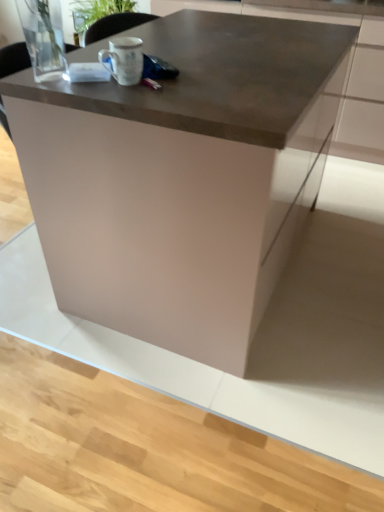
Where is `satin metallic countertop at upper center`? Image resolution: width=384 pixels, height=512 pixels. satin metallic countertop at upper center is located at coordinates (342, 81).

Is matte brown table at center oriented away from white matte mug at upper center?

No, matte brown table at center's orientation is not away from white matte mug at upper center.

From the image's perspective, is matte brown table at center beneath white matte mug at upper center?

Yes, from the image's perspective, matte brown table at center is beneath white matte mug at upper center.

Consider the image. Between matte brown table at center and white matte mug at upper center, which one has more height?

matte brown table at center is taller.

Is matte brown table at center not close to white matte mug at upper center?

matte brown table at center is near white matte mug at upper center, not far away.

Considering the sizes of objects white matte mug at upper center and matte brown table at center in the image provided, who is thinner, white matte mug at upper center or matte brown table at center?

white matte mug at upper center.

Would you say white matte mug at upper center is a long distance from matte brown table at center?

white matte mug at upper center is actually quite close to matte brown table at center.

Considering the positions of objects white matte mug at upper center and matte brown table at center in the image provided, who is behind, white matte mug at upper center or matte brown table at center?

white matte mug at upper center is behind.

Looking at this image, from a real-world perspective, who is located lower, satin metallic countertop at upper center or white matte mug at upper center?

In real-world perspective, satin metallic countertop at upper center is lower.

Is satin metallic countertop at upper center closer to camera compared to white matte mug at upper center?

No, satin metallic countertop at upper center is further to the viewer.

Would you say satin metallic countertop at upper center is a long distance from white matte mug at upper center?

Absolutely, satin metallic countertop at upper center is distant from white matte mug at upper center.

From the image's perspective, which object appears higher, satin metallic countertop at upper center or matte brown table at center?

satin metallic countertop at upper center, from the image's perspective.

Identify the location of cabinetry on the right of matte brown table at center. (342, 81).

How many degrees apart are the facing directions of satin metallic countertop at upper center and matte brown table at center?

They differ by 90.7 degrees in their facing directions.

In the scene shown: From a real-world perspective, which is physically below, satin metallic countertop at upper center or matte brown table at center?

matte brown table at center, from a real-world perspective.

From the image's perspective, which one is positioned lower, white matte mug at upper center or satin metallic countertop at upper center?

From the image's view, white matte mug at upper center is below.

Considering the sizes of objects white matte mug at upper center and satin metallic countertop at upper center in the image provided, who is smaller, white matte mug at upper center or satin metallic countertop at upper center?

With smaller size is white matte mug at upper center.

Is white matte mug at upper center not near satin metallic countertop at upper center?

Answer: white matte mug at upper center is positioned a significant distance from satin metallic countertop at upper center.

Who is shorter, white matte mug at upper center or satin metallic countertop at upper center?

white matte mug at upper center.

From the picture: Does matte brown table at center have a lesser height compared to satin metallic countertop at upper center?

No.

Would you say satin metallic countertop at upper center is part of matte brown table at center's contents?

No.

Is satin metallic countertop at upper center at the back of matte brown table at center?

That's not correct — matte brown table at center is not looking away from satin metallic countertop at upper center.

Image resolution: width=384 pixels, height=512 pixels. Find the location of `coffee cup that appears above the matte brown table at center (from a real-world perspective)`. coffee cup that appears above the matte brown table at center (from a real-world perspective) is located at coordinates (124, 60).

I want to click on table located below the white matte mug at upper center (from the image's perspective), so click(x=182, y=177).

When comparing their distances from white matte mug at upper center, does satin metallic countertop at upper center or matte brown table at center seem closer?

matte brown table at center is closer to white matte mug at upper center.

Considering their positions, is white matte mug at upper center positioned further to satin metallic countertop at upper center than matte brown table at center?

Among the two, white matte mug at upper center is located further to satin metallic countertop at upper center.

Considering their positions, is matte brown table at center positioned closer to satin metallic countertop at upper center than white matte mug at upper center?

Based on the image, matte brown table at center appears to be nearer to satin metallic countertop at upper center.

From the image, which object appears to be nearer to white matte mug at upper center, matte brown table at center or satin metallic countertop at upper center?

matte brown table at center is positioned closer to the anchor white matte mug at upper center.

Based on their spatial positions, is white matte mug at upper center or satin metallic countertop at upper center closer to matte brown table at center?

The object closer to matte brown table at center is white matte mug at upper center.

Looking at the image, which one is located closer to matte brown table at center, satin metallic countertop at upper center or white matte mug at upper center?

white matte mug at upper center lies closer to matte brown table at center than the other object.

You are a GUI agent. You are given a task and a screenshot of the screen. Output one action in this format:
    pyautogui.click(x=<x>, y=<y>)
    Task: Click on the coffee cup between matte brown table at center and satin metallic countertop at upper center in the front-back direction
    
    Given the screenshot: What is the action you would take?
    pyautogui.click(x=124, y=60)